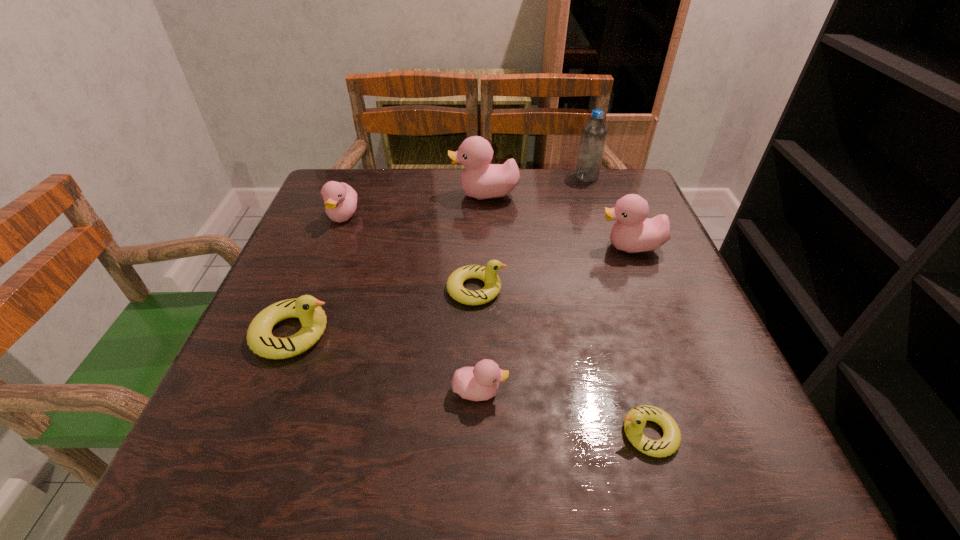
Where is `free region located on the front-facing side of the second smallest pink duckling`? The image size is (960, 540). free region located on the front-facing side of the second smallest pink duckling is located at coordinates (282, 375).

The width and height of the screenshot is (960, 540). I want to click on vacant space positioned 0.090m on the face of the leftmost yellow duckling, so click(383, 333).

Locate an element on the screen. vacant space situated on the front-facing side of the seventh farthest object is located at coordinates (697, 392).

Find the location of `free region located on the face of the second yellow duckling from left to right`. free region located on the face of the second yellow duckling from left to right is located at coordinates (659, 289).

I want to click on vacant space located 0.280m on the face of the rightmost yellow duckling, so [x=433, y=434].

At what (x,y) coordinates should I click in order to perform the action: click on free region located 0.300m on the face of the rightmost yellow duckling. Please return your answer as a coordinate pair (x, y). Looking at the image, I should click on (420, 434).

Find the location of `vacant space located on the face of the rightmost yellow duckling`. vacant space located on the face of the rightmost yellow duckling is located at coordinates (513, 434).

Identify the location of water bottle present at the far edge. Image resolution: width=960 pixels, height=540 pixels. (594, 132).

Identify the location of object located at the near edge. This screenshot has height=540, width=960. (635, 420).

Locate an element on the screen. This screenshot has height=540, width=960. water bottle that is at the right edge is located at coordinates (594, 132).